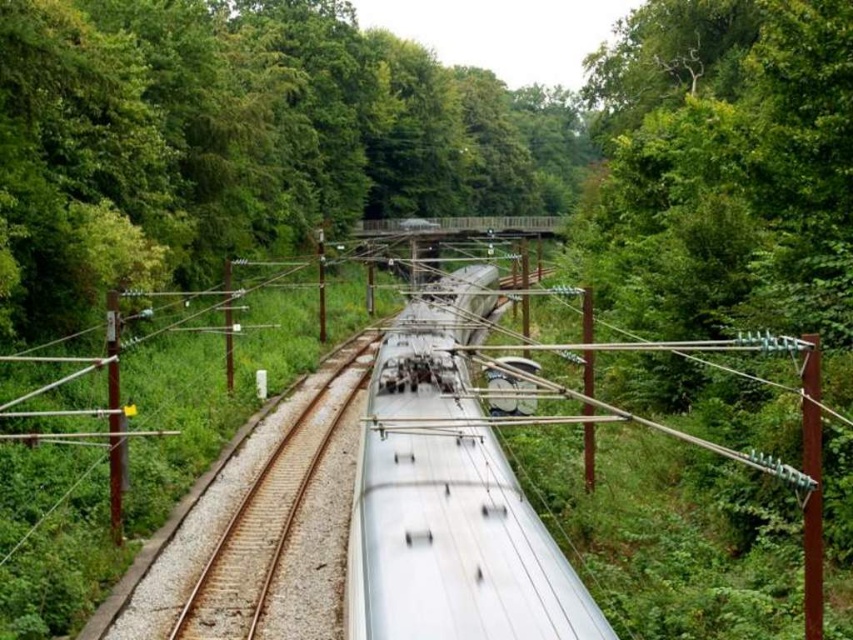
Question: Is silver metallic train at center smaller than metallic silver train track at center?

Choices:
 (A) yes
 (B) no

Answer: (B)

Question: Is silver metallic train at center wider than metallic silver train track at center?

Choices:
 (A) yes
 (B) no

Answer: (A)

Question: Can you confirm if silver metallic train at center is positioned to the right of metallic silver train track at center?

Choices:
 (A) yes
 (B) no

Answer: (A)

Question: Among these objects, which one is nearest to the camera?

Choices:
 (A) silver metallic train at center
 (B) metallic silver train track at center

Answer: (A)